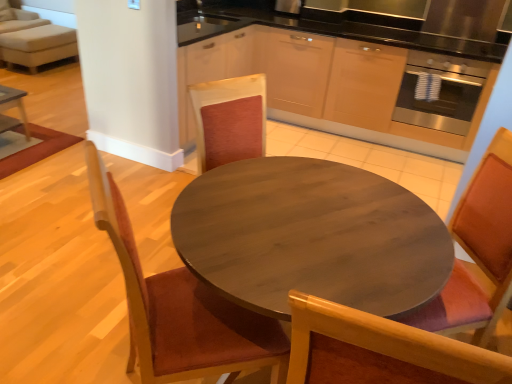
In order to click on wooden table at center in this screenshot , I will do `click(310, 236)`.

Identify the location of stainless steel oven at right. (440, 92).

The width and height of the screenshot is (512, 384). Describe the element at coordinates (181, 309) in the screenshot. I see `wooden chair at left, placed as the second chair when sorted from right to left` at that location.

Identify the location of wooden chair at left, placed as the second chair when sorted from right to left. (181, 309).

Locate an element on the screen. The width and height of the screenshot is (512, 384). wooden table at center is located at coordinates 310,236.

Looking at the image, does wooden chair at left, the 1th chair viewed from the left, seem bigger or smaller compared to wooden table at center?

In the image, wooden chair at left, the 1th chair viewed from the left, appears to be smaller than wooden table at center.

How different are the orientations of wooden chair at left, the 1th chair viewed from the left, and wooden table at center in degrees?

The angular difference between wooden chair at left, the 1th chair viewed from the left, and wooden table at center is 133 degrees.

Is point (189, 378) closer or farther from the camera than point (258, 198)?

Point (189, 378) is farther from the camera than point (258, 198).

From the image's perspective, is wooden chair at left, placed as the second chair when sorted from right to left, located above wooden table at center?

Yes, from the image's perspective, wooden chair at left, placed as the second chair when sorted from right to left, is above wooden table at center.

Are wooden chair at left, the 1th chair viewed from the left, and light beige fabric couch at upper left far apart?

Absolutely, wooden chair at left, the 1th chair viewed from the left, is distant from light beige fabric couch at upper left.

Between wooden chair at left, the 1th chair viewed from the left, and light beige fabric couch at upper left, which one is positioned in front?

wooden chair at left, the 1th chair viewed from the left, is more forward.

Is wooden chair at left, the 1th chair viewed from the left, outside of light beige fabric couch at upper left?

That's correct, wooden chair at left, the 1th chair viewed from the left, is outside of light beige fabric couch at upper left.

Does stainless steel oven at right have a lesser width compared to light beige fabric couch at upper left?

Yes, stainless steel oven at right is thinner than light beige fabric couch at upper left.

Based on the photo, from the image's perspective, is stainless steel oven at right above light beige fabric couch at upper left?

No.

From a real-world perspective, is stainless steel oven at right on light beige fabric couch at upper left?

Indeed, from a real-world perspective, stainless steel oven at right stands above light beige fabric couch at upper left.

What are the coordinates of `oven on the right side of light beige fabric couch at upper left` in the screenshot? It's located at (440, 92).

Considering the sizes of objects light beige fabric couch at upper left and wooden chair at center, the 2th chair from the left, in the image provided, who is wider, light beige fabric couch at upper left or wooden chair at center, the 2th chair from the left,?

Wider between the two is light beige fabric couch at upper left.

Which object is more forward, light beige fabric couch at upper left or wooden chair at center, the 1th chair viewed from the right?

wooden chair at center, the 1th chair viewed from the right.

Are light beige fabric couch at upper left and wooden chair at center, the 2th chair from the left, located far from each other?

light beige fabric couch at upper left is far away from wooden chair at center, the 2th chair from the left.

In order to click on couch below the wooden chair at center, the 2th chair from the left (from a real-world perspective) in this screenshot , I will do `click(34, 40)`.

Which object is wider, wooden table at center or wooden chair at center, the 2th chair from the left?

Wider between the two is wooden table at center.

Is wooden table at center further to the viewer compared to wooden chair at center, the 1th chair viewed from the right?

No, the depth of wooden table at center is less than that of wooden chair at center, the 1th chair viewed from the right.

Does wooden table at center appear on the left side of stainless steel oven at right?

Correct, you'll find wooden table at center to the left of stainless steel oven at right.

Which of these two, wooden table at center or stainless steel oven at right, is smaller?

stainless steel oven at right is smaller.

From a real-world perspective, which is physically below, wooden table at center or stainless steel oven at right?

wooden table at center.

Locate an element on the screen. The height and width of the screenshot is (384, 512). the 1st chair below when counting from the stainless steel oven at right (from the image's perspective) is located at coordinates (478, 251).

Consider the image. Considering the relative positions of stainless steel oven at right and wooden chair at center, the 1th chair viewed from the right, in the image provided, is stainless steel oven at right to the left or to the right of wooden chair at center, the 1th chair viewed from the right,?

stainless steel oven at right is to the right of wooden chair at center, the 1th chair viewed from the right.

Would you say stainless steel oven at right is a long distance from wooden chair at center, the 2th chair from the left?

Yes, stainless steel oven at right and wooden chair at center, the 2th chair from the left, are located far from each other.

Is stainless steel oven at right turned away from wooden chair at center, the 2th chair from the left?

No, stainless steel oven at right is not facing the opposite direction of wooden chair at center, the 2th chair from the left.

There is a wooden table at center. Identify the location of the 1st chair above it (from a real-world perspective). (181, 309).

Starting from the light beige fabric couch at upper left, which chair is the 1st one to the right? Please provide its 2D coordinates.

[(181, 309)]

From the image, which object appears to be nearer to stainless steel oven at right, wooden chair at left, the 1th chair viewed from the left, or wooden chair at center, the 1th chair viewed from the right?

Among the two, wooden chair at center, the 1th chair viewed from the right, is located nearer to stainless steel oven at right.

Estimate the real-world distances between objects in this image. Which object is closer to wooden chair at left, the 1th chair viewed from the left, light beige fabric couch at upper left or wooden chair at center, the 1th chair viewed from the right?

wooden chair at center, the 1th chair viewed from the right.

Which object lies further to the anchor point light beige fabric couch at upper left, wooden chair at center, the 2th chair from the left, or wooden table at center?

wooden chair at center, the 2th chair from the left, lies further to light beige fabric couch at upper left than the other object.

Based on the photo, considering their positions, is stainless steel oven at right positioned further to light beige fabric couch at upper left than wooden table at center?

Among the two, wooden table at center is located further to light beige fabric couch at upper left.

From the image, which object appears to be nearer to stainless steel oven at right, light beige fabric couch at upper left or wooden table at center?

wooden table at center.

Estimate the real-world distances between objects in this image. Which object is further from wooden chair at left, placed as the second chair when sorted from right to left, light beige fabric couch at upper left or wooden table at center?

Among the two, light beige fabric couch at upper left is located further to wooden chair at left, placed as the second chair when sorted from right to left.

Considering their positions, is light beige fabric couch at upper left positioned further to wooden chair at left, placed as the second chair when sorted from right to left, than stainless steel oven at right?

light beige fabric couch at upper left lies further to wooden chair at left, placed as the second chair when sorted from right to left, than the other object.

Based on their spatial positions, is light beige fabric couch at upper left or wooden table at center further from wooden chair at center, the 2th chair from the left?

light beige fabric couch at upper left lies further to wooden chair at center, the 2th chair from the left, than the other object.

At what (x,y) coordinates should I click in order to perform the action: click on kitchen & dining room table located between wooden chair at left, placed as the second chair when sorted from right to left, and light beige fabric couch at upper left in the depth direction. Please return your answer as a coordinate pair (x, y). The image size is (512, 384). Looking at the image, I should click on (310, 236).

I want to click on kitchen & dining room table between light beige fabric couch at upper left and stainless steel oven at right, so (310, 236).

In order to click on kitchen & dining room table located between wooden chair at left, the 1th chair viewed from the left, and wooden chair at center, the 1th chair viewed from the right, in the left-right direction in this screenshot , I will do coord(310,236).

I want to click on kitchen & dining room table between light beige fabric couch at upper left and wooden chair at center, the 1th chair viewed from the right, in the horizontal direction, so click(310, 236).